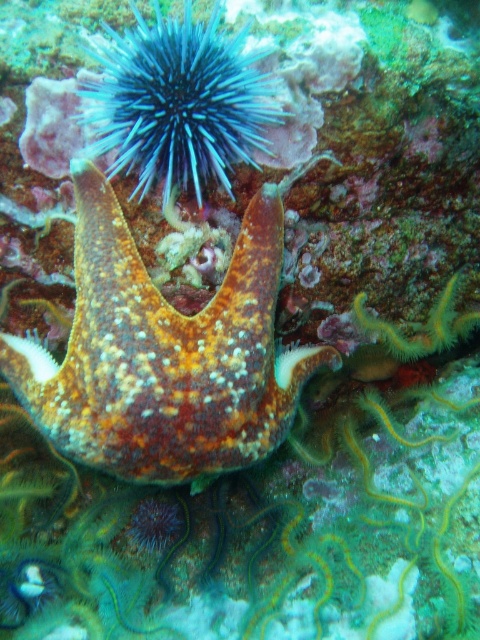
You are a marine biologist observing this underwater scene. You need to locate the rusty textured starfish at center and the blue spiny sea urchin at upper center. Based on their positions, which one is directly above the other?

The blue spiny sea urchin at upper center is directly above the rusty textured starfish at center because the starfish is positioned under the sea urchin.

You are a marine biologist observing this underwater scene. You need to collect samples of both the rusty textured starfish at center and the blue spiny sea urchin at upper center. Based on their positions, which organism is closer to you?

The rusty textured starfish at center is closer to you because the blue spiny sea urchin at upper center is behind it.

You are a marine biologist diving in the coral reef and want to take a closeup photo of the rusty textured starfish at center. Your camera has a minimum focusing distance of 30 inches. Can you take the photo without moving closer?

The rusty textured starfish at center and camera are 35.85 inches apart from each other. Since the minimum focusing distance is 30 inches, you can take the photo without moving closer because the distance is within the camera range.